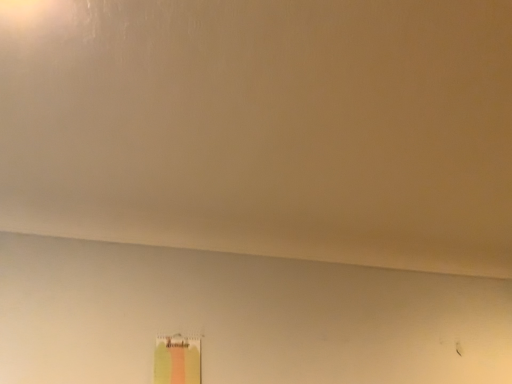
Where is `translucent paper calendar at lower center`? The image size is (512, 384). translucent paper calendar at lower center is located at coordinates (177, 360).

This screenshot has height=384, width=512. What do you see at coordinates (177, 360) in the screenshot?
I see `translucent paper calendar at lower center` at bounding box center [177, 360].

The height and width of the screenshot is (384, 512). I want to click on translucent paper calendar at lower center, so click(177, 360).